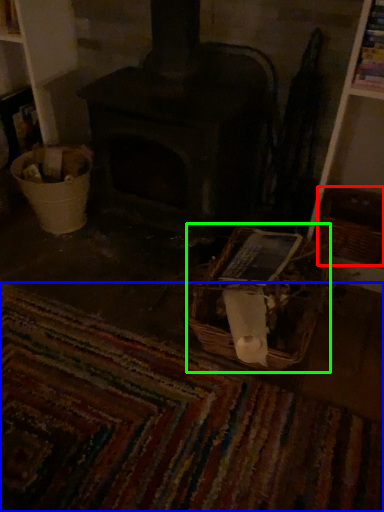
Question: Estimate the real-world distances between objects in this image. Which object is closer to basket (highlighted by a red box), mat (highlighted by a blue box) or basket (highlighted by a green box)?

Choices:
 (A) mat
 (B) basket

Answer: (B)